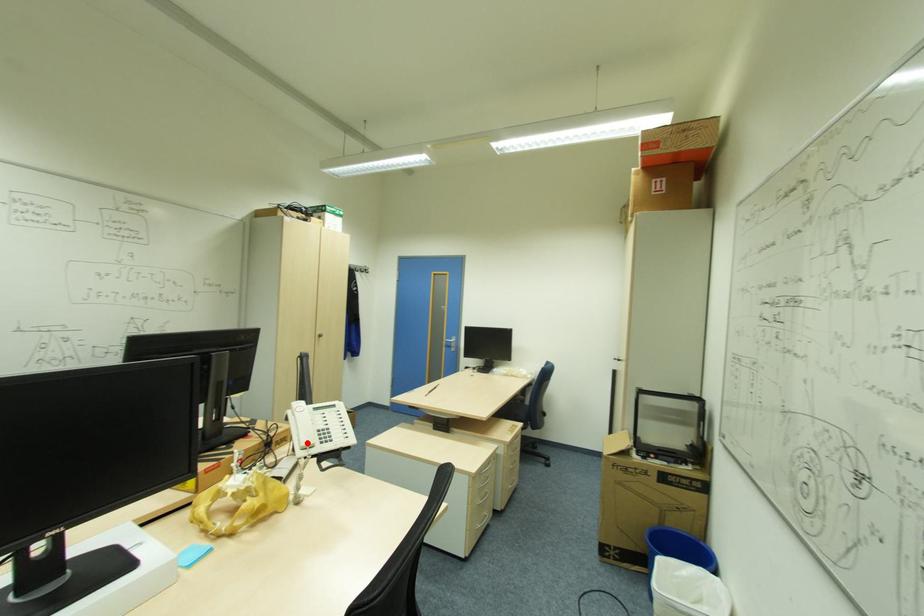
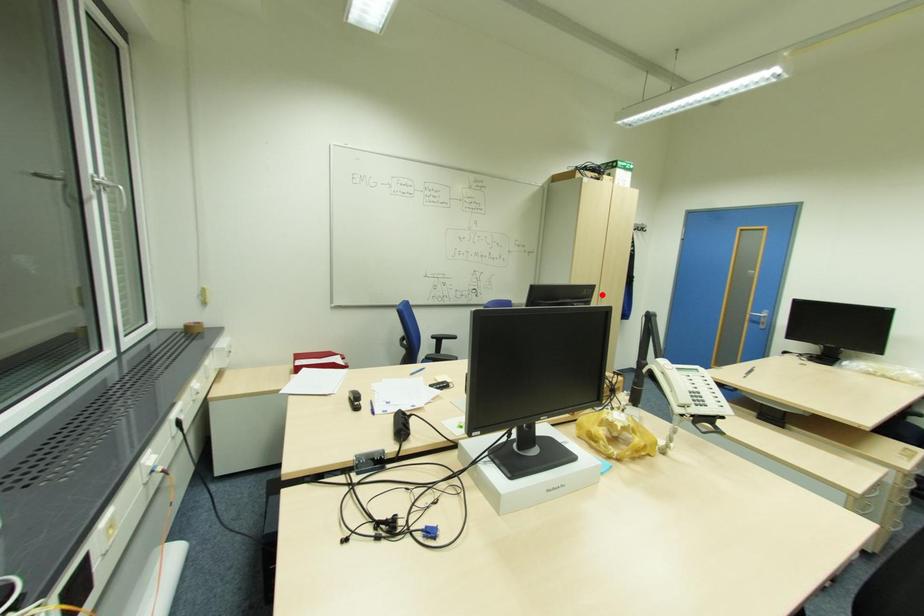
I am providing you with two images of the same scene from different viewpoints. A red point is marked on the first image and another point is marked on the second image. Do the highlighted points in image1 and image2 indicate the same real-world spot?

No